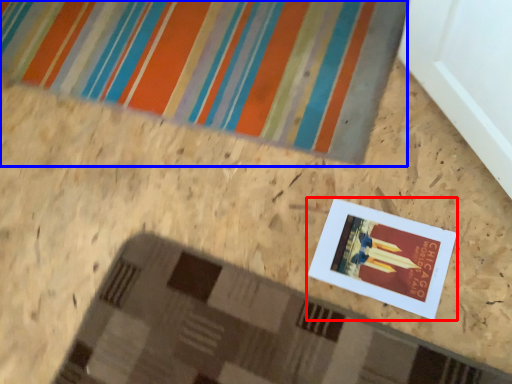
Question: Which object appears farthest to the camera in this image, picture frame (highlighted by a red box) or bath mat (highlighted by a blue box)?

Choices:
 (A) picture frame
 (B) bath mat

Answer: (B)